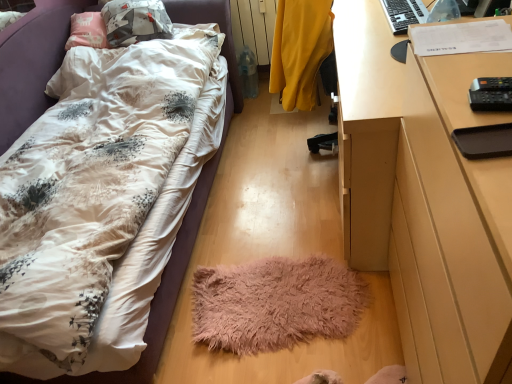
Describe the element at coordinates (404, 14) in the screenshot. I see `black plastic keyboard at upper right` at that location.

Where is `yellow matte radiator at upper center`? yellow matte radiator at upper center is located at coordinates (254, 27).

Identify the location of wooden desk at right. (425, 199).

The image size is (512, 384). Describe the element at coordinates (425, 199) in the screenshot. I see `wooden desk at right` at that location.

Find the location of a particular element. fuzzy pink mat at center is located at coordinates (275, 303).

Describe the element at coordinates (484, 141) in the screenshot. The height and width of the screenshot is (384, 512). I see `black matte tray at right` at that location.

Find the location of a particular element. yellow fabric chair at center is located at coordinates (302, 52).

Does fluffy white bed at lower left touch black plastic remote control at right?

fluffy white bed at lower left and black plastic remote control at right are not in contact.

Find the location of `bed beneath the black plastic remote control at right (from a real-world perspective)`. bed beneath the black plastic remote control at right (from a real-world perspective) is located at coordinates (183, 219).

Is fluffy white bed at lower left situated inside black plastic remote control at right or outside?

fluffy white bed at lower left is not inside black plastic remote control at right, it's outside.

Which is more to the right, wooden desk at right or fluffy white bed at lower left?

wooden desk at right is more to the right.

Is the surface of wooden desk at right in direct contact with fluffy white bed at lower left?

No, wooden desk at right is not making contact with fluffy white bed at lower left.

From a real-world perspective, is wooden desk at right over fluffy white bed at lower left?

Yes, from a real-world perspective, wooden desk at right is on top of fluffy white bed at lower left.

What's the angular difference between wooden desk at right and fluffy white bed at lower left's facing directions?

There is a 90.1-degree angle between the facing directions of wooden desk at right and fluffy white bed at lower left.

How different are the orientations of wooden desk at right and yellow matte radiator at upper center in degrees?

The angular difference between wooden desk at right and yellow matte radiator at upper center is 89 degrees.

Is wooden desk at right bigger than yellow matte radiator at upper center?

Correct, wooden desk at right is larger in size than yellow matte radiator at upper center.

Considering the sizes of objects wooden desk at right and yellow matte radiator at upper center in the image provided, who is wider, wooden desk at right or yellow matte radiator at upper center?

Wider between the two is wooden desk at right.

Considering the relative sizes of wooden desk at right and yellow matte radiator at upper center in the image provided, is wooden desk at right taller than yellow matte radiator at upper center?

Yes, wooden desk at right is taller than yellow matte radiator at upper center.

You are a GUI agent. You are given a task and a screenshot of the screen. Output one action in this format:
    pyautogui.click(x=<x>, y=<y>)
    Task: Click on the bed that appears below the black plastic keyboard at upper right (from a real-world perspective)
    The height and width of the screenshot is (384, 512).
    Given the screenshot: What is the action you would take?
    pyautogui.click(x=183, y=219)

Is black plastic keyboard at upper right a part of fluffy white bed at lower left?

Actually, black plastic keyboard at upper right is outside fluffy white bed at lower left.

Which object is closer to the camera, fluffy white bed at lower left or black plastic keyboard at upper right?

fluffy white bed at lower left is in front.

How far apart are fluffy white bed at lower left and black plastic keyboard at upper right?

fluffy white bed at lower left is 1.23 meters from black plastic keyboard at upper right.

Is black plastic remote control at right wider or thinner than black plastic keyboard at upper right?

black plastic remote control at right is thinner than black plastic keyboard at upper right.

Considering the relative sizes of black plastic remote control at right and black plastic keyboard at upper right in the image provided, is black plastic remote control at right smaller than black plastic keyboard at upper right?

Correct, black plastic remote control at right occupies less space than black plastic keyboard at upper right.

How far apart are black plastic remote control at right and black plastic keyboard at upper right?

The distance of black plastic remote control at right from black plastic keyboard at upper right is 16.44 inches.

Based on the photo, could you tell me if black plastic remote control at right is turned towards black plastic keyboard at upper right?

No, black plastic remote control at right is not oriented towards black plastic keyboard at upper right.

Is wooden desk at right shorter than fuzzy pink mat at center?

In fact, wooden desk at right may be taller than fuzzy pink mat at center.

From a real-world perspective, which is physically below, wooden desk at right or fuzzy pink mat at center?

From a 3D spatial view, fuzzy pink mat at center is below.

Who is smaller, wooden desk at right or fuzzy pink mat at center?

Smaller between the two is fuzzy pink mat at center.

From the image's perspective, relative to fuzzy pink mat at center, is wooden desk at right above or below?

Based on their image positions, wooden desk at right is located above fuzzy pink mat at center.

Would you say black plastic keyboard at upper right is inside or outside wooden desk at right?

black plastic keyboard at upper right is not inside wooden desk at right, it's outside.

From a real-world perspective, who is located lower, black plastic keyboard at upper right or wooden desk at right?

wooden desk at right, from a real-world perspective.

How different are the orientations of black plastic keyboard at upper right and wooden desk at right in degrees?

There is a 0.954-degree angle between the facing directions of black plastic keyboard at upper right and wooden desk at right.

Considering the sizes of objects black plastic keyboard at upper right and wooden desk at right in the image provided, who is shorter, black plastic keyboard at upper right or wooden desk at right?

With less height is black plastic keyboard at upper right.

This screenshot has width=512, height=384. What are the coordinates of `bed lying on the left of black plastic remote control at right` in the screenshot? It's located at (183, 219).

You are a GUI agent. You are given a task and a screenshot of the screen. Output one action in this format:
    pyautogui.click(x=<x>, y=<y>)
    Task: Click on the desk that appears on the right of fluffy white bed at lower left
    This screenshot has height=384, width=512.
    Given the screenshot: What is the action you would take?
    pyautogui.click(x=425, y=199)

Based on the photo, based on their spatial positions, is black matte tray at right or wooden desk at right closer to black plastic keyboard at upper right?

wooden desk at right is closer to black plastic keyboard at upper right.

Based on their spatial positions, is yellow matte radiator at upper center or black plastic remote control at right closer to fluffy white bed at lower left?

Among the two, yellow matte radiator at upper center is located nearer to fluffy white bed at lower left.

Estimate the real-world distances between objects in this image. Which object is further from black plastic keyboard at upper right, yellow fabric chair at center or yellow matte radiator at upper center?

Based on the image, yellow matte radiator at upper center appears to be further to black plastic keyboard at upper right.

Based on their spatial positions, is fuzzy pink mat at center or yellow matte radiator at upper center closer to wooden desk at right?

fuzzy pink mat at center lies closer to wooden desk at right than the other object.

Which object lies further to the anchor point yellow fabric chair at center, yellow matte radiator at upper center or fuzzy pink mat at center?

yellow matte radiator at upper center lies further to yellow fabric chair at center than the other object.

From the image, which object appears to be farther from black plastic keyboard at upper right, black matte tray at right or yellow fabric chair at center?

yellow fabric chair at center lies further to black plastic keyboard at upper right than the other object.

When comparing their distances from black matte tray at right, does yellow matte radiator at upper center or wooden desk at right seem further?

yellow matte radiator at upper center is further to black matte tray at right.

Looking at the image, which one is located further to black plastic keyboard at upper right, wooden desk at right or fuzzy pink mat at center?

fuzzy pink mat at center lies further to black plastic keyboard at upper right than the other object.

This screenshot has height=384, width=512. What are the coordinates of `pad that lies between black plastic remote control at right and wooden desk at right from top to bottom` in the screenshot? It's located at (484, 141).

Locate an element on the screen. The image size is (512, 384). remote control positioned between wooden desk at right and yellow matte radiator at upper center from near to far is located at coordinates (490, 94).

You are a GUI agent. You are given a task and a screenshot of the screen. Output one action in this format:
    pyautogui.click(x=<x>, y=<y>)
    Task: Click on the remote control between wooden desk at right and fuzzy pink mat at center from front to back
    
    Given the screenshot: What is the action you would take?
    pyautogui.click(x=490, y=94)

Identify the location of chair positioned between wooden desk at right and black plastic keyboard at upper right from near to far. (302, 52).